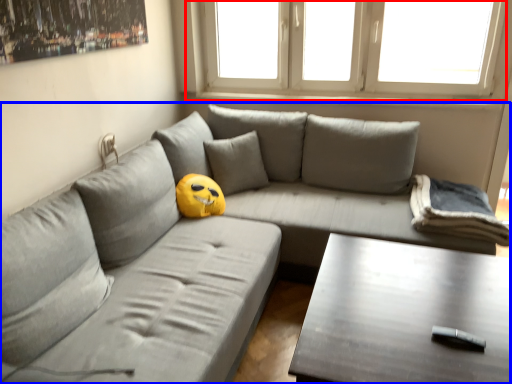
Question: Which point is further to the camera, window (highlighted by a red box) or studio couch (highlighted by a blue box)?

Choices:
 (A) window
 (B) studio couch

Answer: (A)